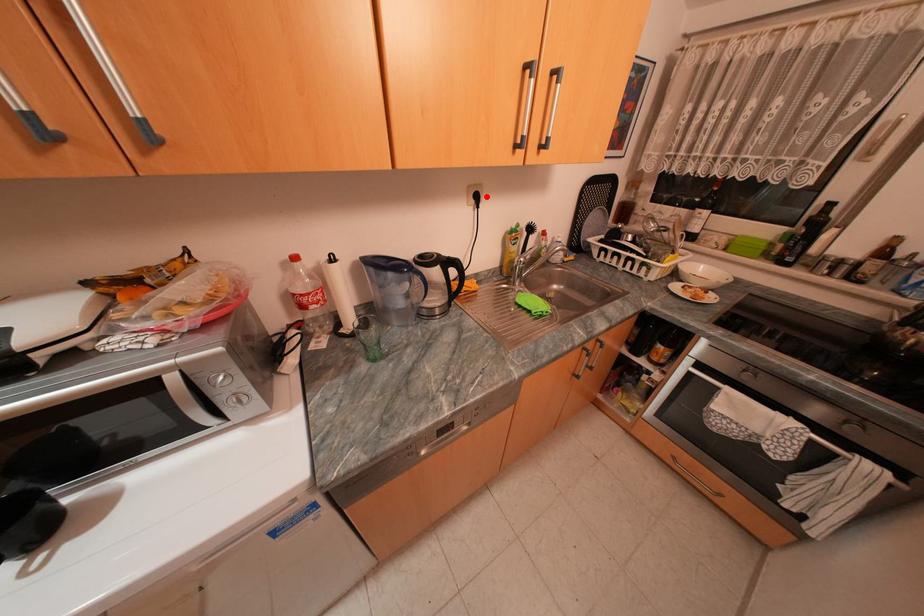
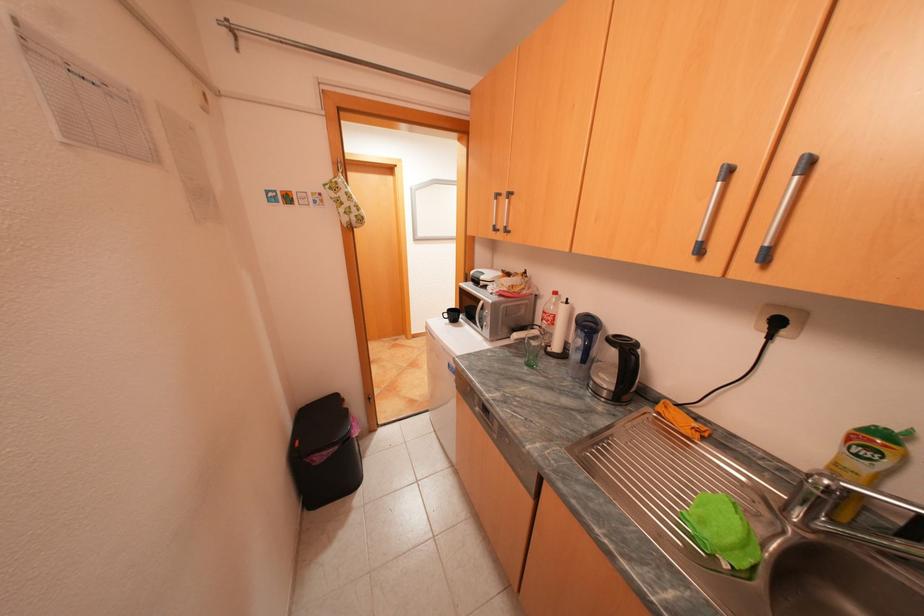
Where in the second image is the point corresponding to the highlighted location from the first image?

(786, 323)